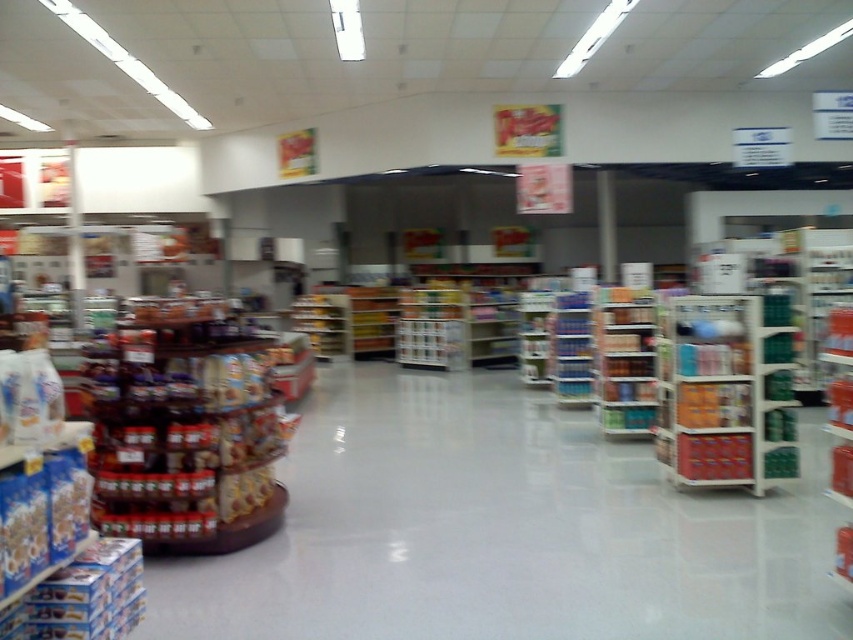
Question: Is green plastic shelf at center further to camera compared to blue plastic bottles at center?

Choices:
 (A) yes
 (B) no

Answer: (B)

Question: Is green plastic shelf at center wider than blue plastic bottles at center?

Choices:
 (A) no
 (B) yes

Answer: (B)

Question: Among these objects, which one is nearest to the camera?

Choices:
 (A) metallic silver shelves at center-right
 (B) green plastic shelf at center
 (C) blue plastic bottles at center
 (D) shiny plastic snacks at left

Answer: (D)

Question: Does shiny plastic snacks at left appear under metallic silver shelves at center-right?

Choices:
 (A) yes
 (B) no

Answer: (A)

Question: Which point is closer to the camera?

Choices:
 (A) (779, 467)
 (B) (628, 410)

Answer: (A)

Question: Estimate the real-world distances between objects in this image. Which object is farther from the blue plastic bottles at center?

Choices:
 (A) metallic silver shelves at center-right
 (B) green plastic shelf at center

Answer: (A)